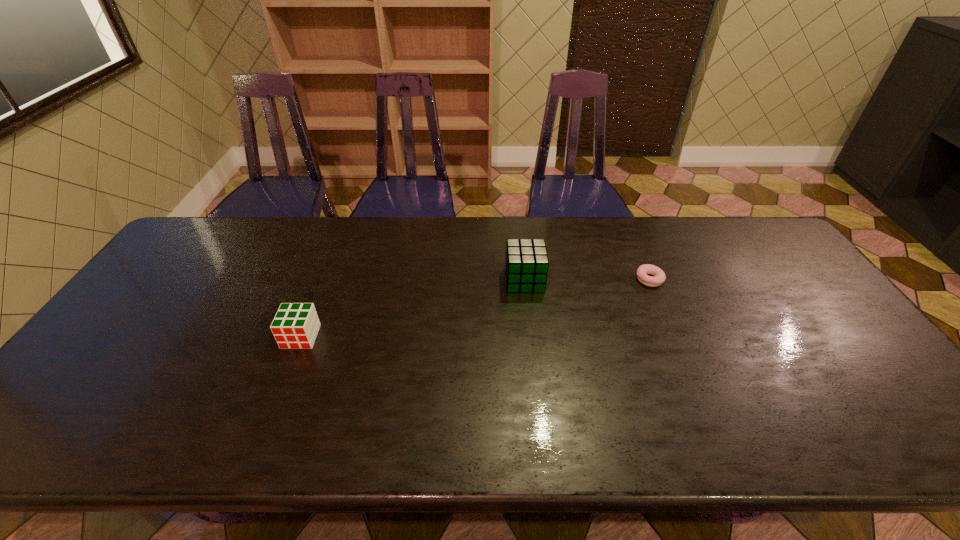
Identify the location of vacant area that lies between the taller cube and the shortest object. The height and width of the screenshot is (540, 960). (587, 280).

Identify the location of vacant region between the left cube and the rightmost object. (475, 308).

Locate an element on the screen. This screenshot has width=960, height=540. vacant area that lies between the doughnut and the shorter cube is located at coordinates (475, 308).

Find the location of a particular element. the closest object relative to the left cube is located at coordinates 526,266.

Choose which object is the nearest neighbor to the leftmost object. Please provide its 2D coordinates. Your answer should be formatted as a tuple, i.e. [(x, y)], where the tuple contains the x and y coordinates of a point satisfying the conditions above.

[(526, 266)]

The height and width of the screenshot is (540, 960). In order to click on free space that satisfies the following two spatial constraints: 1. on the back side of the doughnut; 2. on the left side of the second object from left to right in this screenshot , I will do `click(524, 279)`.

You are a GUI agent. You are given a task and a screenshot of the screen. Output one action in this format:
    pyautogui.click(x=<x>, y=<y>)
    Task: Click on the free space that satisfies the following two spatial constraints: 1. on the back side of the rightmost object; 2. on the left side of the farther cube
    The height and width of the screenshot is (540, 960).
    Given the screenshot: What is the action you would take?
    pyautogui.click(x=524, y=279)

Identify the location of vacant point that satisfies the following two spatial constraints: 1. on the back side of the taller cube; 2. on the left side of the doughnut. Image resolution: width=960 pixels, height=540 pixels. (524, 279).